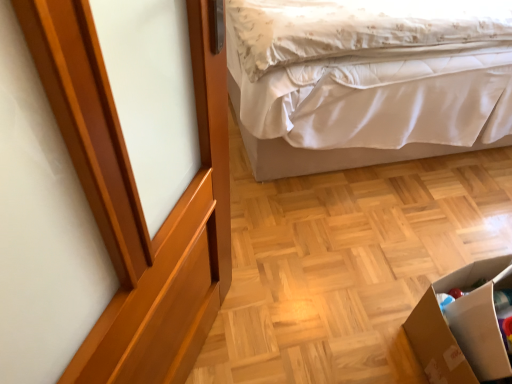
Question: From the image's perspective, is glossy wood screen door at upper left located above cardboard box at lower right?

Choices:
 (A) yes
 (B) no

Answer: (A)

Question: Considering the relative sizes of glossy wood screen door at upper left and cardboard box at lower right in the image provided, is glossy wood screen door at upper left shorter than cardboard box at lower right?

Choices:
 (A) yes
 (B) no

Answer: (B)

Question: Is glossy wood screen door at upper left positioned far away from cardboard box at lower right?

Choices:
 (A) yes
 (B) no

Answer: (B)

Question: Is glossy wood screen door at upper left oriented towards cardboard box at lower right?

Choices:
 (A) yes
 (B) no

Answer: (A)

Question: Is glossy wood screen door at upper left to the right of cardboard box at lower right from the viewer's perspective?

Choices:
 (A) yes
 (B) no

Answer: (B)

Question: From a real-world perspective, is glossy wood screen door at upper left above or below white satin bed at upper right?

Choices:
 (A) below
 (B) above

Answer: (B)

Question: From the image's perspective, is glossy wood screen door at upper left positioned above or below white satin bed at upper right?

Choices:
 (A) below
 (B) above

Answer: (A)

Question: In terms of height, does glossy wood screen door at upper left look taller or shorter compared to white satin bed at upper right?

Choices:
 (A) tall
 (B) short

Answer: (A)

Question: Is glossy wood screen door at upper left in front of or behind white satin bed at upper right in the image?

Choices:
 (A) front
 (B) behind

Answer: (A)

Question: From a real-world perspective, is cardboard box at lower right above or below glossy wood screen door at upper left?

Choices:
 (A) below
 (B) above

Answer: (A)

Question: In terms of size, does cardboard box at lower right appear bigger or smaller than glossy wood screen door at upper left?

Choices:
 (A) small
 (B) big

Answer: (A)

Question: Considering the positions of cardboard box at lower right and glossy wood screen door at upper left in the image, is cardboard box at lower right taller or shorter than glossy wood screen door at upper left?

Choices:
 (A) short
 (B) tall

Answer: (A)

Question: Is cardboard box at lower right wider or thinner than glossy wood screen door at upper left?

Choices:
 (A) thin
 (B) wide

Answer: (B)

Question: Considering the positions of white satin bed at upper right and glossy wood screen door at upper left in the image, is white satin bed at upper right taller or shorter than glossy wood screen door at upper left?

Choices:
 (A) tall
 (B) short

Answer: (B)

Question: Is point [x=497, y=66] positioned closer to the camera than point [x=105, y=107]?

Choices:
 (A) farther
 (B) closer

Answer: (A)